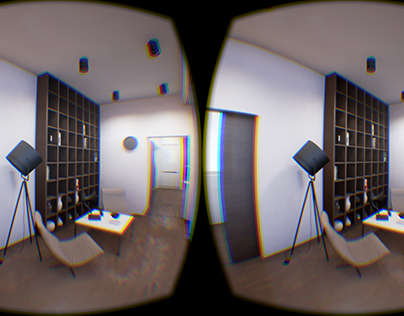
You are a GUI agent. You are given a task and a screenshot of the screen. Output one action in this format:
    pyautogui.click(x=<x>, y=<y>)
    Task: Click on the wood floor
    
    Given the screenshot: What is the action you would take?
    pyautogui.click(x=317, y=282), pyautogui.click(x=78, y=282)